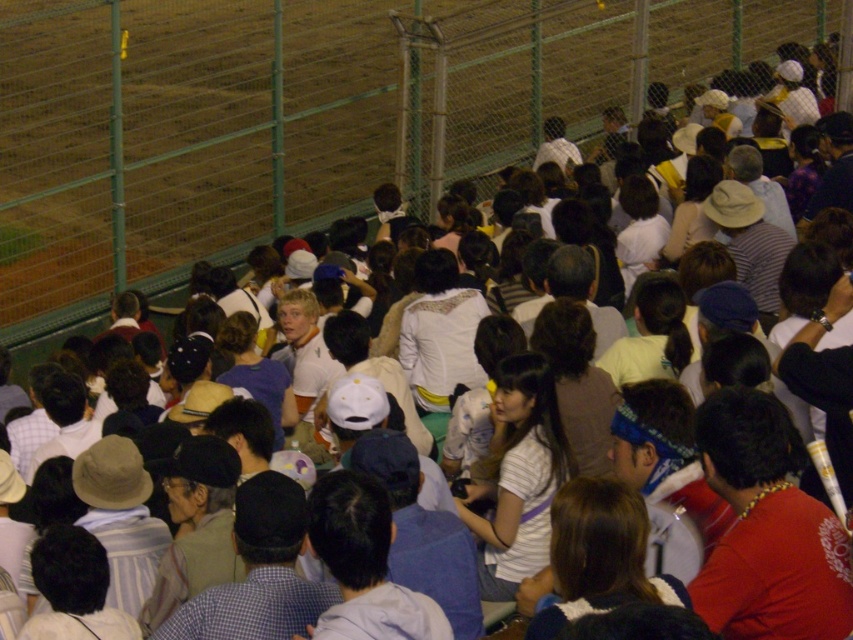
Which is more to the right, white striped shirt at center or dark blue fabric at center?

Positioned to the right is white striped shirt at center.

Who is higher up, white striped shirt at center or dark blue fabric at center?

white striped shirt at center is higher up.

Which is in front, point (550, 445) or point (318, 522)?

Point (318, 522)

Identify the location of white striped shirt at center. (519, 476).

From the picture: Can you confirm if red fabric shirt at center is positioned to the left of matte gray hat at center?

In fact, red fabric shirt at center is to the right of matte gray hat at center.

Who is more distant from viewer, (741, 499) or (299, 592)?

The point (299, 592) is more distant.

The height and width of the screenshot is (640, 853). What are the coordinates of `red fabric shirt at center` in the screenshot? It's located at (766, 531).

Is white striped shirt at center further to the viewer compared to matte gray hat at center?

Yes, white striped shirt at center is further from the viewer.

Does white striped shirt at center have a greater height compared to matte gray hat at center?

Yes.

Image resolution: width=853 pixels, height=640 pixels. What do you see at coordinates (519, 476) in the screenshot?
I see `white striped shirt at center` at bounding box center [519, 476].

Identify the location of white striped shirt at center. This screenshot has width=853, height=640. (519, 476).